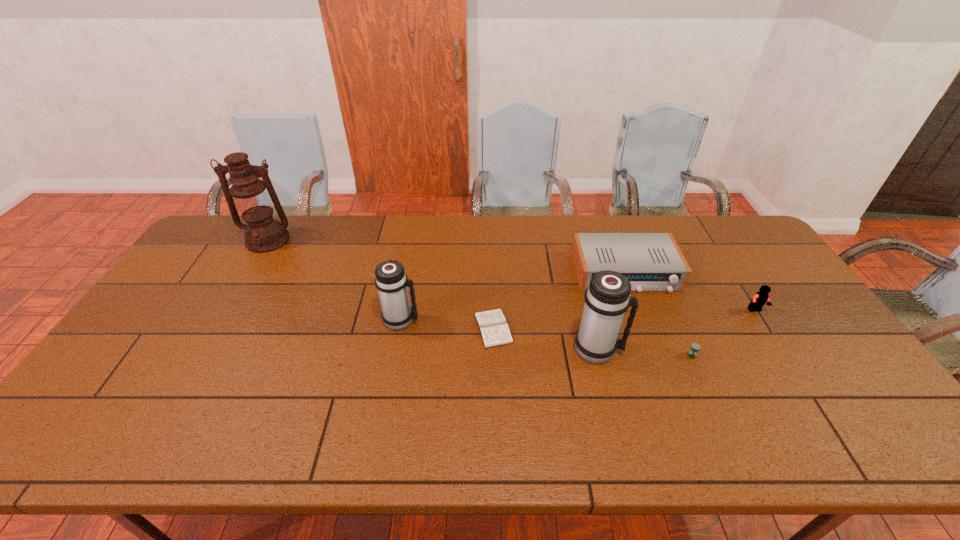
This screenshot has height=540, width=960. Find the location of `the left thermos bottle`. the left thermos bottle is located at coordinates (392, 282).

The image size is (960, 540). I want to click on the farther thermos bottle, so click(x=392, y=282).

In order to click on the right thermos bottle in this screenshot , I will do `click(607, 298)`.

Locate an element on the screen. This screenshot has width=960, height=540. the taller thermos bottle is located at coordinates (607, 298).

You are a GUI agent. You are given a task and a screenshot of the screen. Output one action in this format:
    pyautogui.click(x=<x>, y=<y>)
    Task: Click on the Lego
    The height and width of the screenshot is (540, 960).
    Given the screenshot: What is the action you would take?
    pyautogui.click(x=760, y=298)

Locate an element on the screen. the tallest object is located at coordinates (248, 195).

You are a GUI agent. You are given a task and a screenshot of the screen. Output one action in this format:
    pyautogui.click(x=<x>, y=<y>)
    Task: Click on the oil lamp
    This screenshot has width=960, height=540.
    Given the screenshot: What is the action you would take?
    pyautogui.click(x=248, y=195)

The image size is (960, 540). Find the location of `diary`. diary is located at coordinates (492, 324).

Identify the location of the shortest object. The width and height of the screenshot is (960, 540). (492, 324).

Where is `the third shortest object`? the third shortest object is located at coordinates (651, 261).